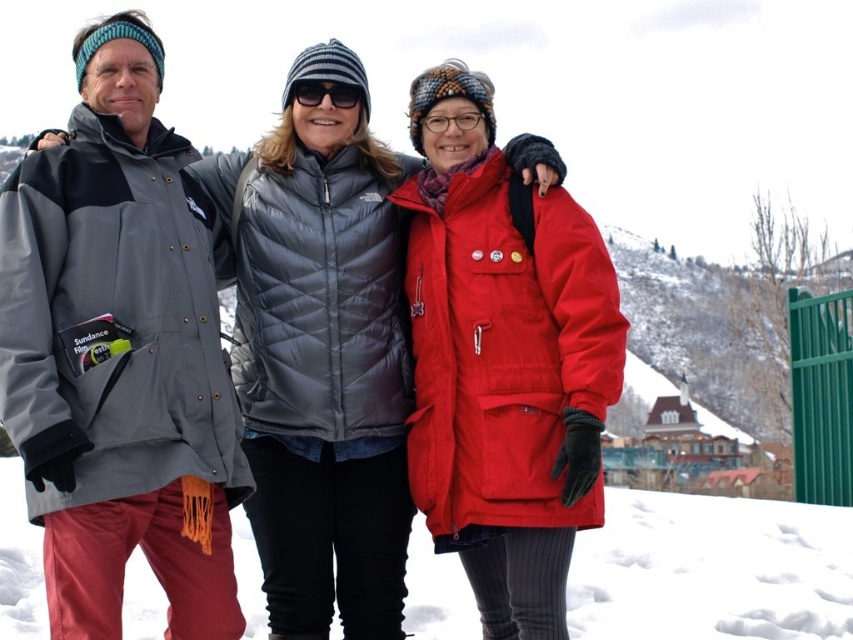
You are a photographer trying to capture a clear shot of the black reflective sunglasses at center and the white snow at lower center. Which object might cause glare or reflection issues in your photo?

The black reflective sunglasses at center may cause glare or reflection issues because they are reflective and positioned to the left of the white snow at lower center, which could create unwanted reflections in the photo.

You are standing in the snowy scene and want to take a photo of the matte gray puffer jacket at center and the white snow at lower center. Which object will appear larger in the photo?

The matte gray puffer jacket at center will appear larger in the photo because it is closer to the viewer than the white snow at lower center.